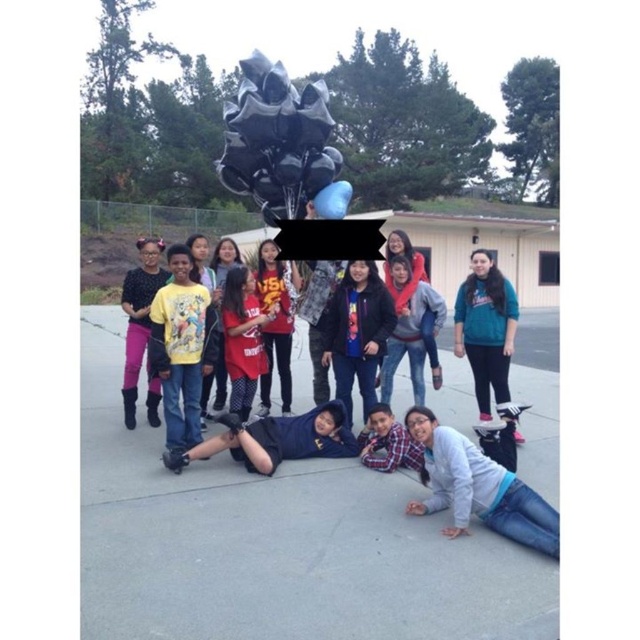
Consider the image. Can you confirm if black matte hoodie at center is smaller than matte black shirt at center?

Yes.

Can you confirm if black matte hoodie at center is positioned to the right of matte black shirt at center?

Indeed, black matte hoodie at center is positioned on the right side of matte black shirt at center.

Is point (260, 419) positioned after point (156, 276)?

No.

What are the coordinates of `black matte hoodie at center` in the screenshot? It's located at (275, 440).

Is teal fleece jacket at lower right positioned behind black matte hoodie at center?

Yes, teal fleece jacket at lower right is behind black matte hoodie at center.

Which of these two, teal fleece jacket at lower right or black matte hoodie at center, stands shorter?

black matte hoodie at center is shorter.

Where is `teal fleece jacket at lower right`? The image size is (640, 640). teal fleece jacket at lower right is located at coordinates (484, 328).

In order to click on teal fleece jacket at lower right in this screenshot , I will do `click(484, 328)`.

Who is positioned more to the left, teal fleece jacket at lower right or plaid shirt at lower center?

From the viewer's perspective, plaid shirt at lower center appears more on the left side.

Is teal fleece jacket at lower right in front of plaid shirt at lower center?

No, it is behind plaid shirt at lower center.

Which is behind, point (497, 275) or point (372, 435)?

Positioned behind is point (497, 275).

Identify the location of teal fleece jacket at lower right. coord(484,328).